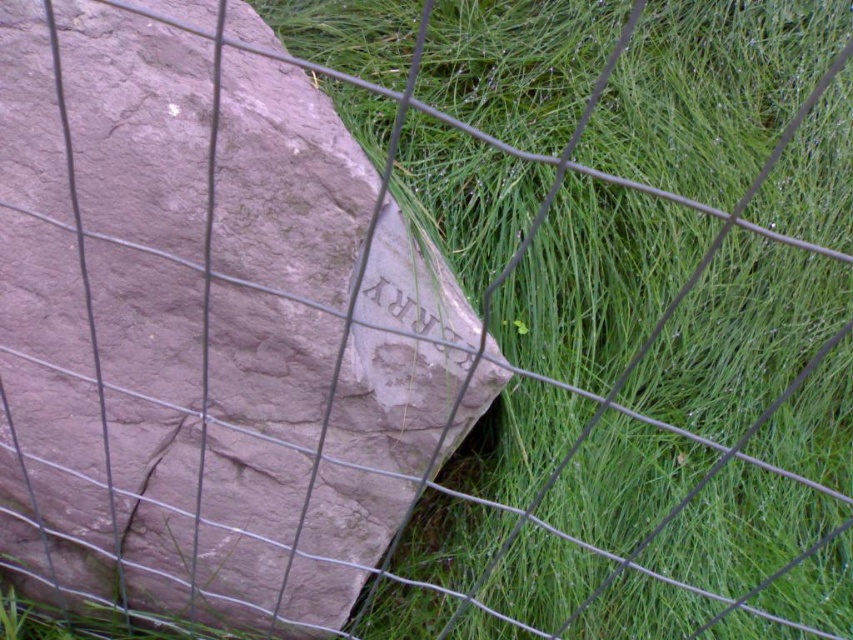
Does green grass at center have a greater height compared to rustic stone boulder at center?

Yes.

Who is more distant from viewer, (633, 547) or (143, 595)?

Positioned behind is point (633, 547).

Between point (706, 314) and point (38, 84), which one is positioned in front?

Point (38, 84)

At what (x,y) coordinates should I click in order to perform the action: click on green grass at center. Please return your answer as a coordinate pair (x, y). The image size is (853, 640). Looking at the image, I should click on (711, 90).